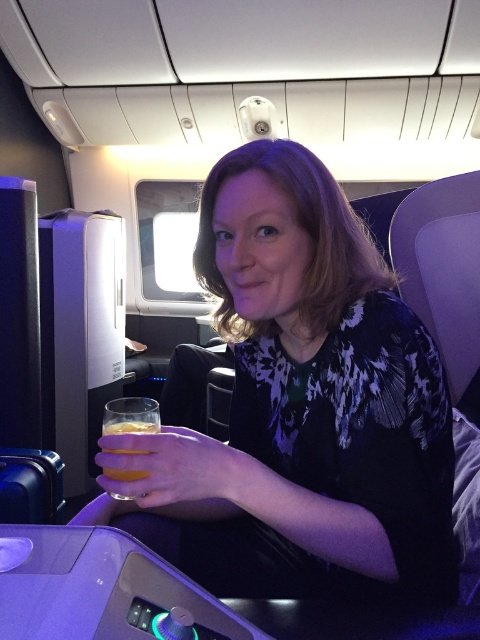
You are a flight attendant checking the seating area. You notice the matte black dress at center and the translucent glass at lower left. Is the dress covering the glass?

The matte black dress at center is positioned over the translucent glass at lower left, so yes, the dress is covering the glass.

You are a flight attendant checking the seating area. You notice the matte black dress at center and the translucent glass at lower left. Which object is closer to you as you face the scene?

The matte black dress at center is closer to you because it is in front of the translucent glass at lower left.

You are a flight attendant checking the cabin. You notice the matte black dress at center and the translucent glass at lower left. Which object is closer to the ceiling?

Result: The matte black dress at center is taller than the translucent glass at lower left, so it is closer to the ceiling.